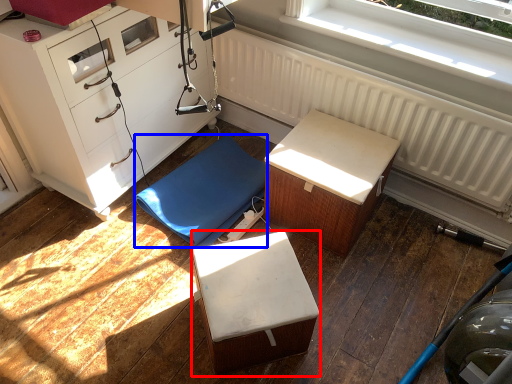
Question: Which object is closer to the camera taking this photo, furniture (highlighted by a red box) or furniture (highlighted by a blue box)?

Choices:
 (A) furniture
 (B) furniture

Answer: (A)